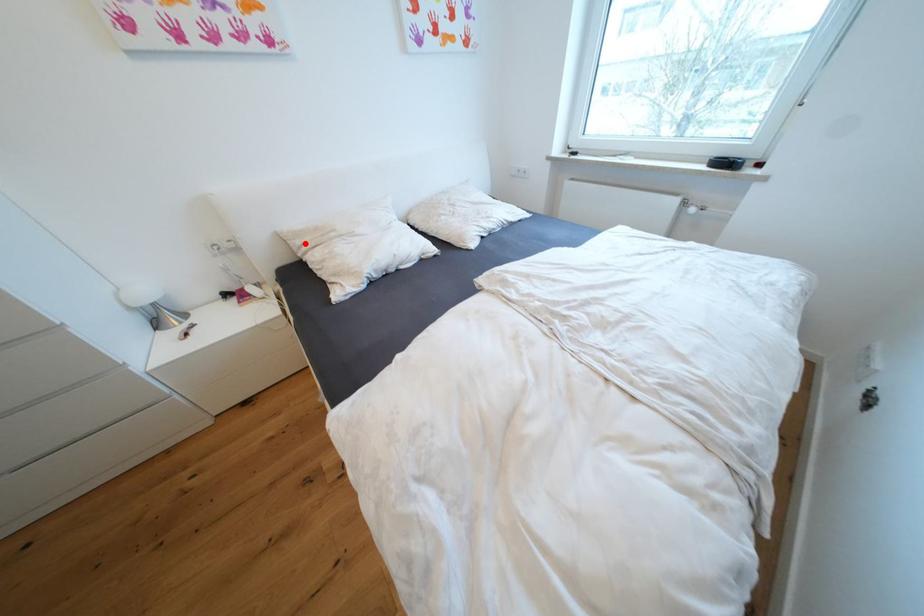
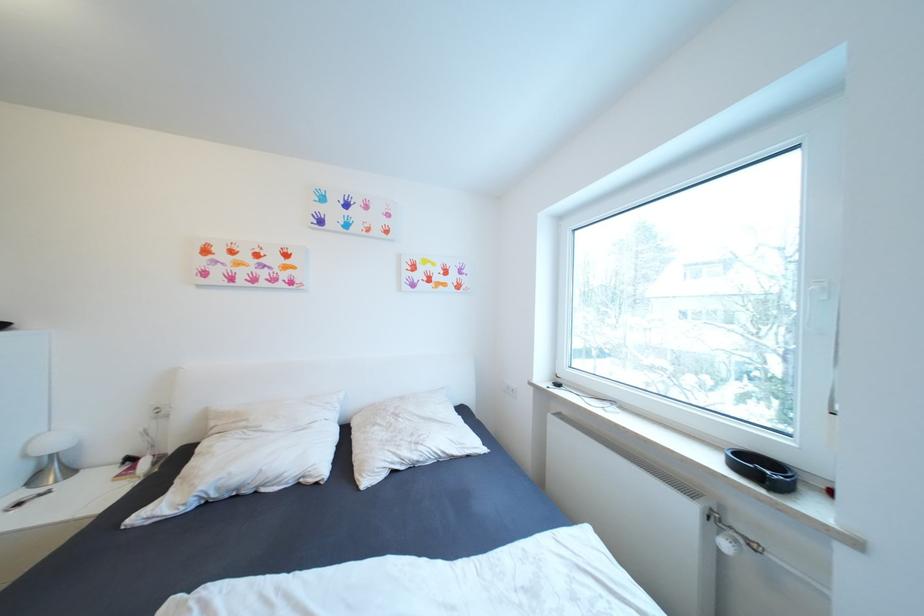
Locate, in the second image, the point that corresponds to the highlighted location in the first image.

(220, 424)